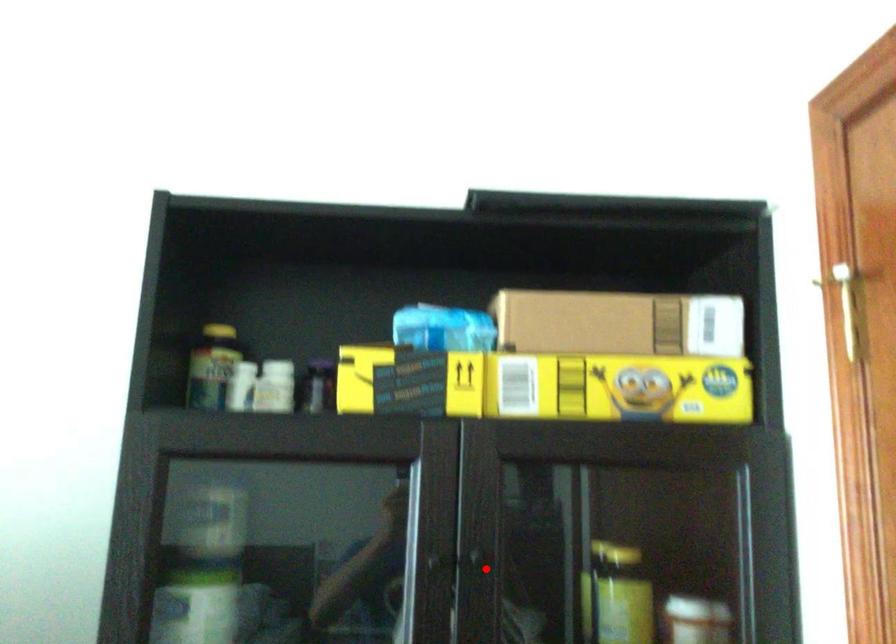
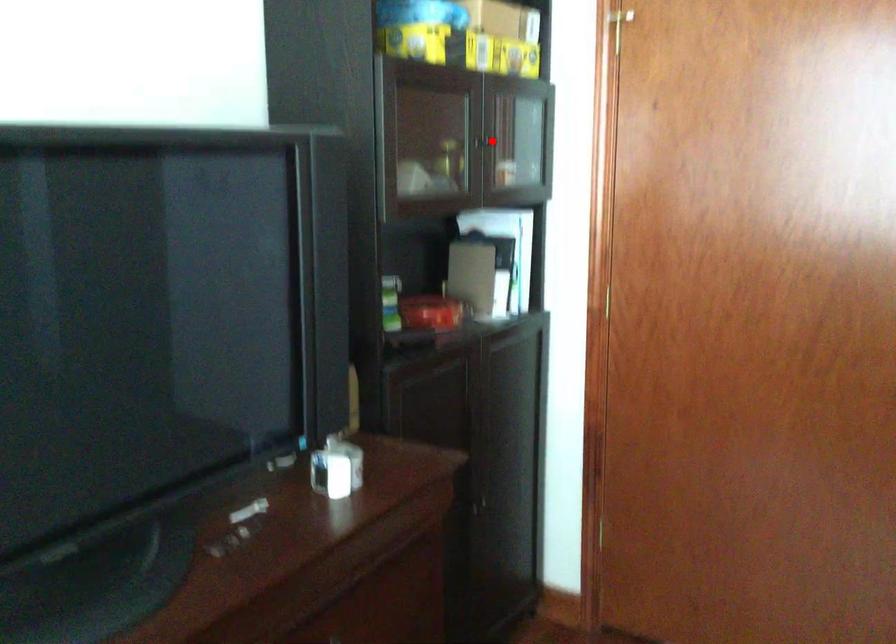
I am providing you with two images of the same scene from different viewpoints. A red point is marked on the first image and another point is marked on the second image. Is the red point in image1 aligned with the point shown in image2?

Yes